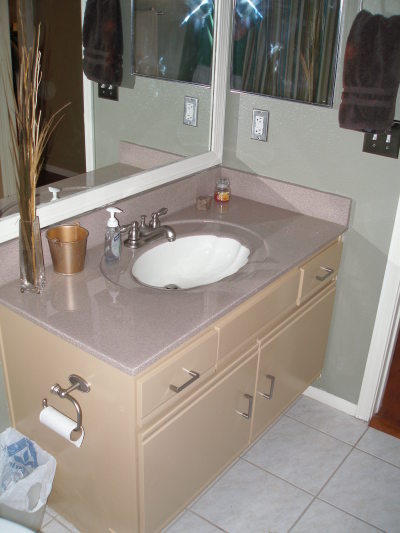
This screenshot has height=533, width=400. Find the location of `right drawer`. right drawer is located at coordinates (322, 272).